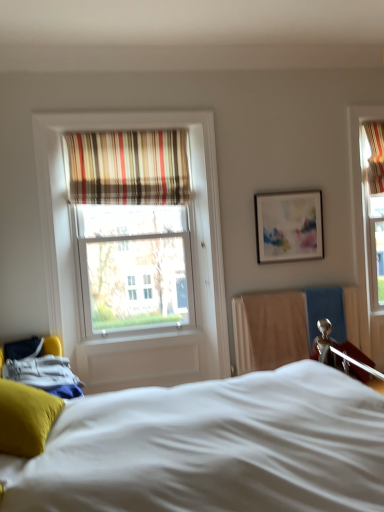
Locate an element on the screen. blank space above matte white picture frame at upper right (from a real-world perspective) is located at coordinates (287, 190).